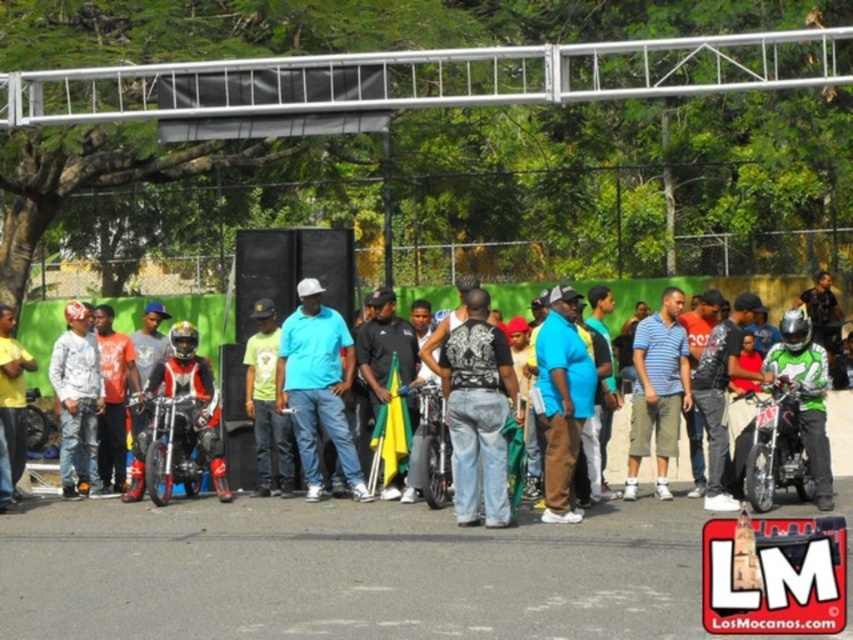
Looking at this image, you are a photographer at this event and want to capture a photo of both the matte black motorcycle at center and the shiny metallic motorcycle at right. Since you want both motorcycles to be in focus, you need to know their positions relative to each other. Are they aligned in a straight line from your current position, or is one behind the other?

The shiny metallic motorcycle at right is behind the matte black motorcycle at center, so they are not aligned in a straight line from your current position. One is positioned behind the other.

You are a photographer at the event and want to capture both the matte black motorcycle at center and the shiny metallic motorcycle at right in a single shot. Based on their positions, which motorcycle will appear larger in the photo?

The matte black motorcycle at center appears larger in the photo because it is positioned closer to the photographer than the shiny metallic motorcycle at right.